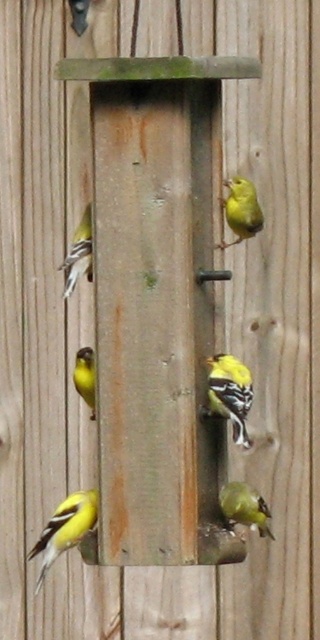
Between matte yellow bird at left and matte yellow bird at center, which one has less height?

Standing shorter between the two is matte yellow bird at center.

Who is more distant from viewer, (64, 273) or (82, 369)?

The point (64, 273) is more distant.

Locate an element on the screen. Image resolution: width=320 pixels, height=640 pixels. matte yellow bird at left is located at coordinates (79, 253).

Does yellow matte bird at lower center appear under matte yellow bird at left?

Correct, yellow matte bird at lower center is located below matte yellow bird at left.

Based on the photo, between yellow matte bird at lower center and matte yellow bird at left, which one has more height?

matte yellow bird at left

Describe the element at coordinates (245, 508) in the screenshot. I see `yellow matte bird at lower center` at that location.

You are a GUI agent. You are given a task and a screenshot of the screen. Output one action in this format:
    pyautogui.click(x=<x>, y=<y>)
    Task: Click on the yellow matte bird at lower center
    The height and width of the screenshot is (640, 320).
    Given the screenshot: What is the action you would take?
    point(245,508)

Can you confirm if yellow matte bird at lower center is thinner than matte yellow bird at center?

In fact, yellow matte bird at lower center might be wider than matte yellow bird at center.

Which is in front, point (262, 497) or point (73, 378)?

Positioned in front is point (262, 497).

Does point (248, 524) come behind point (73, 381)?

No, (248, 524) is in front of (73, 381).

At what (x,y) coordinates should I click in order to perform the action: click on yellow matte bird at lower center. Please return your answer as a coordinate pair (x, y). The width and height of the screenshot is (320, 640). Looking at the image, I should click on (245, 508).